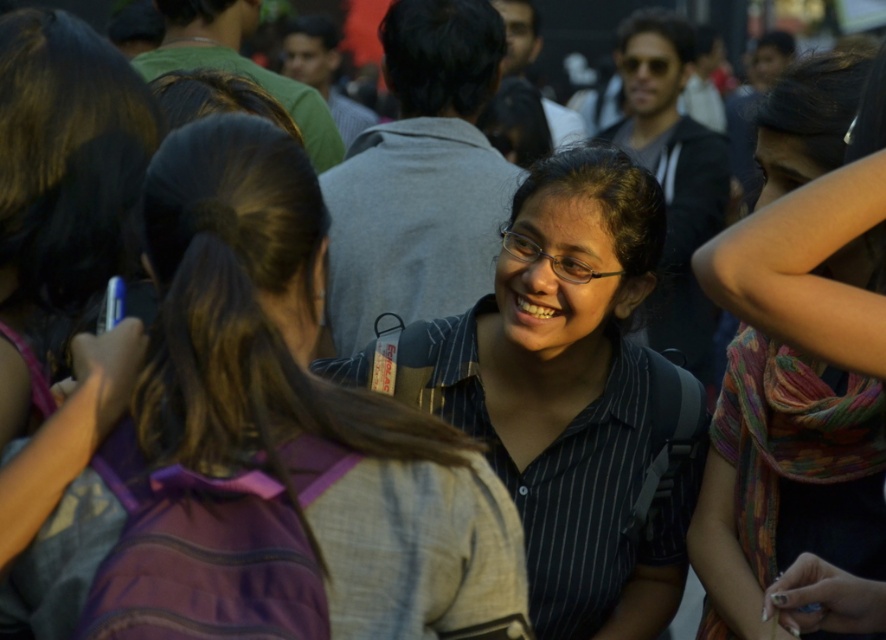
Does striped shirt at center have a lesser width compared to black striped shirt at center?

Incorrect, striped shirt at center's width is not less than black striped shirt at center's.

Is point (331, 628) closer to viewer compared to point (597, 560)?

That is True.

The image size is (886, 640). Find the location of `striped shirt at center`. striped shirt at center is located at coordinates (271, 445).

At what (x,y) coordinates should I click in order to perform the action: click on black striped shirt at center. Please return your answer as a coordinate pair (x, y). Looking at the image, I should click on (569, 396).

Can you confirm if black striped shirt at center is bigger than multicolored scarf at center?

Indeed, black striped shirt at center has a larger size compared to multicolored scarf at center.

The width and height of the screenshot is (886, 640). Find the location of `black striped shirt at center`. black striped shirt at center is located at coordinates (569, 396).

Image resolution: width=886 pixels, height=640 pixels. What are the coordinates of `black striped shirt at center` in the screenshot? It's located at (569, 396).

Does striped shirt at center have a greater height compared to multicolored scarf at center?

Yes.

Is striped shirt at center bigger than multicolored scarf at center?

Yes, striped shirt at center is bigger than multicolored scarf at center.

Locate an element on the screen. The width and height of the screenshot is (886, 640). striped shirt at center is located at coordinates (271, 445).

Locate an element on the screen. striped shirt at center is located at coordinates (271, 445).